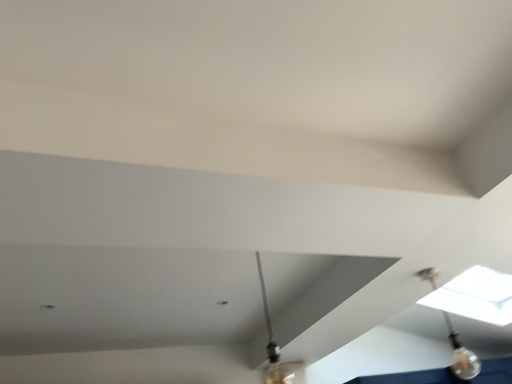
What is the approximate width of metallic silver lamp at center?

5.63 inches.

Measure the distance between point [269,314] and camera.

10.95 feet.

The image size is (512, 384). What do you see at coordinates (274, 344) in the screenshot?
I see `metallic silver lamp at center` at bounding box center [274, 344].

Locate an element on the screen. metallic silver lamp at center is located at coordinates (274, 344).

What do you see at coordinates (461, 355) in the screenshot? The image size is (512, 384). I see `clear glass bulb at upper right` at bounding box center [461, 355].

Identify the location of clear glass bulb at upper right. This screenshot has width=512, height=384. (461, 355).

Identify the location of metallic silver lamp at center. The width and height of the screenshot is (512, 384). (274, 344).

Which is more to the right, clear glass bulb at upper right or metallic silver lamp at center?

From the viewer's perspective, clear glass bulb at upper right appears more on the right side.

Who is more distant, clear glass bulb at upper right or metallic silver lamp at center?

clear glass bulb at upper right is further away from the camera.

Looking at this image, which is less distant, [476,367] or [280,380]?

Point [476,367] is positioned farther from the camera compared to point [280,380].

From the image's perspective, who appears lower, clear glass bulb at upper right or metallic silver lamp at center?

clear glass bulb at upper right.

From a real-world perspective, which object rests below the other?

In real-world perspective, clear glass bulb at upper right is lower.

Consider the image. Can you confirm if clear glass bulb at upper right is thinner than metallic silver lamp at center?

Yes, clear glass bulb at upper right is thinner than metallic silver lamp at center.

Between clear glass bulb at upper right and metallic silver lamp at center, which one has less height?

clear glass bulb at upper right is shorter.

Is clear glass bulb at upper right bigger or smaller than metallic silver lamp at center?

Considering their sizes, clear glass bulb at upper right takes up less space than metallic silver lamp at center.

Can we say clear glass bulb at upper right lies outside metallic silver lamp at center?

Yes, clear glass bulb at upper right is located beyond the bounds of metallic silver lamp at center.

Are clear glass bulb at upper right and metallic silver lamp at center located far from each other?

That's right, there is a large distance between clear glass bulb at upper right and metallic silver lamp at center.

Is clear glass bulb at upper right looking in the opposite direction of metallic silver lamp at center?

Yes, clear glass bulb at upper right is facing away from metallic silver lamp at center.

How different are the orientations of clear glass bulb at upper right and metallic silver lamp at center in degrees?

The facing directions of clear glass bulb at upper right and metallic silver lamp at center are 92.5 degrees apart.

In the scene shown: How distant is clear glass bulb at upper right from metallic silver lamp at center?

The distance of clear glass bulb at upper right from metallic silver lamp at center is 5.32 feet.

The image size is (512, 384). Identify the location of light fixture behind the metallic silver lamp at center. (461, 355).

Is metallic silver lamp at center at the right side of clear glass bulb at upper right?

No, metallic silver lamp at center is not to the right of clear glass bulb at upper right.

Is metallic silver lamp at center in front of clear glass bulb at upper right?

Yes, metallic silver lamp at center is in front of clear glass bulb at upper right.

Is point (279, 370) closer to viewer compared to point (457, 342)?

Yes, it is in front of point (457, 342).

From the image's perspective, does metallic silver lamp at center appear lower than clear glass bulb at upper right?

No, from the image's perspective, metallic silver lamp at center is not below clear glass bulb at upper right.

From a real-world perspective, which object rests below the other?

In real-world perspective, clear glass bulb at upper right is lower.

Which of these two, metallic silver lamp at center or clear glass bulb at upper right, is thinner?

clear glass bulb at upper right is thinner.

From their relative heights in the image, would you say metallic silver lamp at center is taller or shorter than clear glass bulb at upper right?

In the image, metallic silver lamp at center appears to be taller than clear glass bulb at upper right.

Consider the image. Who is bigger, metallic silver lamp at center or clear glass bulb at upper right?

metallic silver lamp at center is bigger.

Is metallic silver lamp at center positioned beyond the bounds of clear glass bulb at upper right?

metallic silver lamp at center lies outside clear glass bulb at upper right's area.

Is metallic silver lamp at center touching clear glass bulb at upper right?

metallic silver lamp at center is not next to clear glass bulb at upper right, and they're not touching.

Does metallic silver lamp at center turn towards clear glass bulb at upper right?

No, metallic silver lamp at center does not turn towards clear glass bulb at upper right.

Locate an element on the screen. The height and width of the screenshot is (384, 512). light fixture behind the metallic silver lamp at center is located at coordinates (461, 355).

Locate an element on the screen. The image size is (512, 384). lamp in front of the clear glass bulb at upper right is located at coordinates (274, 344).

At what (x,y) coordinates should I click in order to perform the action: click on lamp on the left of clear glass bulb at upper right. Please return your answer as a coordinate pair (x, y). Image resolution: width=512 pixels, height=384 pixels. Looking at the image, I should click on (274, 344).